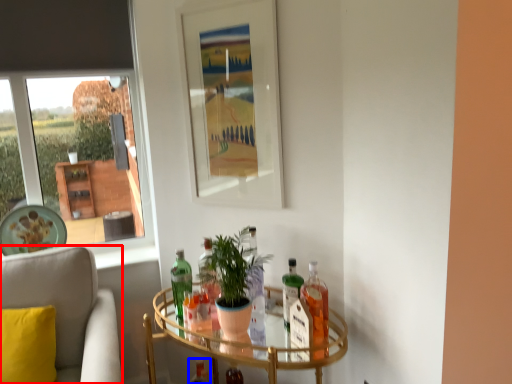
Question: Which point is closer to the camera, chair (highlighted by a red box) or bottle (highlighted by a blue box)?

Choices:
 (A) chair
 (B) bottle

Answer: (A)